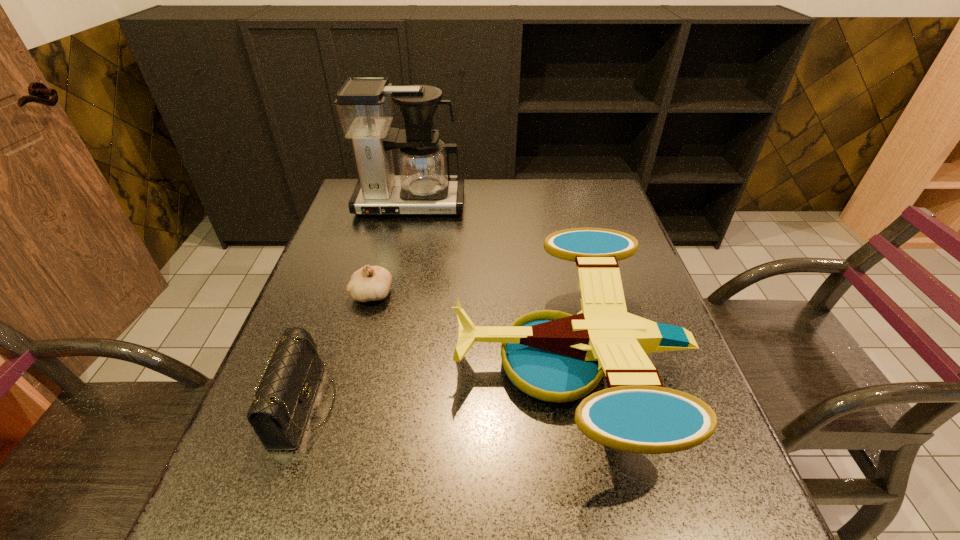
What are the coordinates of `blank space at the far left corner of the desktop` in the screenshot? It's located at (345, 200).

At what (x,y) coordinates should I click in order to perform the action: click on free space at the far right corner. Please return your answer as a coordinate pair (x, y). Looking at the image, I should click on (588, 178).

You are a GUI agent. You are given a task and a screenshot of the screen. Output one action in this format:
    pyautogui.click(x=<x>, y=<y>)
    Task: Click on the free space at the near right corner
    The height and width of the screenshot is (540, 960).
    Given the screenshot: What is the action you would take?
    pyautogui.click(x=698, y=516)

Find the location of a particular element. free point between the second shortest object and the shortest object is located at coordinates (338, 350).

This screenshot has height=540, width=960. In order to click on free space between the garlic and the clutch bag in this screenshot , I will do `click(338, 350)`.

This screenshot has height=540, width=960. Identify the location of vacant area that lies between the coffee maker and the shortest object. click(391, 249).

I want to click on vacant space in between the third shortest object and the clutch bag, so click(x=437, y=383).

Where is `vacant area that lies between the second shortest object and the garlic`? This screenshot has width=960, height=540. vacant area that lies between the second shortest object and the garlic is located at coordinates (338, 350).

At what (x,y) coordinates should I click in order to perform the action: click on free spot between the farthest object and the clutch bag. Please return your answer as a coordinate pair (x, y). The image size is (960, 540). Looking at the image, I should click on (357, 305).

Locate an element on the screen. This screenshot has width=960, height=540. object that ranks as the third closest to the second shortest object is located at coordinates (424, 185).